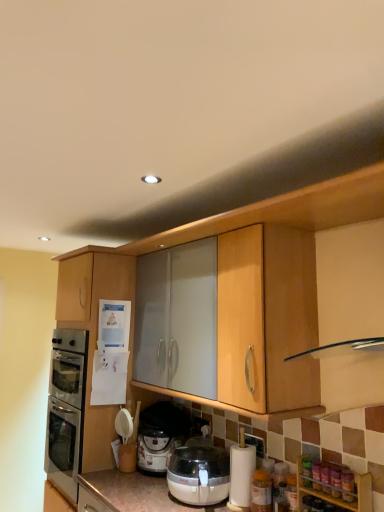
Question: From the image's perspective, is matte wood cabinet at left, the second cabinetry from the right, located beneath translucent plastic pressure cooker at lower center?

Choices:
 (A) no
 (B) yes

Answer: (A)

Question: Is the position of matte wood cabinet at left, the second cabinetry from the front, more distant than that of translucent plastic pressure cooker at lower center?

Choices:
 (A) yes
 (B) no

Answer: (A)

Question: From a real-world perspective, is matte wood cabinet at left, the second cabinetry from the right, positioned over translucent plastic pressure cooker at lower center based on gravity?

Choices:
 (A) yes
 (B) no

Answer: (A)

Question: Is translucent plastic pressure cooker at lower center inside matte wood cabinet at left, the second cabinetry from the front?

Choices:
 (A) no
 (B) yes

Answer: (A)

Question: Can you confirm if matte wood cabinet at left, the 1th cabinetry positioned from the top, is positioned to the left of translucent plastic pressure cooker at lower center?

Choices:
 (A) no
 (B) yes

Answer: (B)

Question: In the image, is translucent plastic pressure cooker at lower center positioned in front of or behind translucent plastic bottle at lower right, placed as the 1th bottle when sorted from top to bottom?

Choices:
 (A) behind
 (B) front

Answer: (A)

Question: In terms of width, does translucent plastic pressure cooker at lower center look wider or thinner when compared to translucent plastic bottle at lower right, the second bottle when ordered from bottom to top?

Choices:
 (A) thin
 (B) wide

Answer: (B)

Question: From their relative heights in the image, would you say translucent plastic pressure cooker at lower center is taller or shorter than translucent plastic bottle at lower right, placed as the 1th bottle when sorted from top to bottom?

Choices:
 (A) tall
 (B) short

Answer: (A)

Question: Is translucent plastic pressure cooker at lower center bigger or smaller than translucent plastic bottle at lower right, positioned as the first bottle in front-to-back order?

Choices:
 (A) small
 (B) big

Answer: (B)

Question: From their relative heights in the image, would you say translucent plastic bottle at lower right, arranged as the 2th bottle when viewed from the left, is taller or shorter than translucent plastic pressure cooker at lower center?

Choices:
 (A) tall
 (B) short

Answer: (B)

Question: Looking at their shapes, would you say translucent plastic bottle at lower right, arranged as the 2th bottle when viewed from the left, is wider or thinner than translucent plastic pressure cooker at lower center?

Choices:
 (A) thin
 (B) wide

Answer: (A)

Question: In the image, is translucent plastic bottle at lower right, the 2th bottle positioned from the back, positioned in front of or behind translucent plastic pressure cooker at lower center?

Choices:
 (A) front
 (B) behind

Answer: (A)

Question: Is point (340, 482) positioned closer to the camera than point (178, 437)?

Choices:
 (A) closer
 (B) farther

Answer: (A)

Question: Is point (92, 429) closer or farther from the camera than point (347, 500)?

Choices:
 (A) farther
 (B) closer

Answer: (A)

Question: Is matte wood cabinet at left, the 1th cabinetry when ordered from left to right, bigger or smaller than translucent plastic bottle at lower right, the first bottle in the right-to-left sequence?

Choices:
 (A) big
 (B) small

Answer: (A)